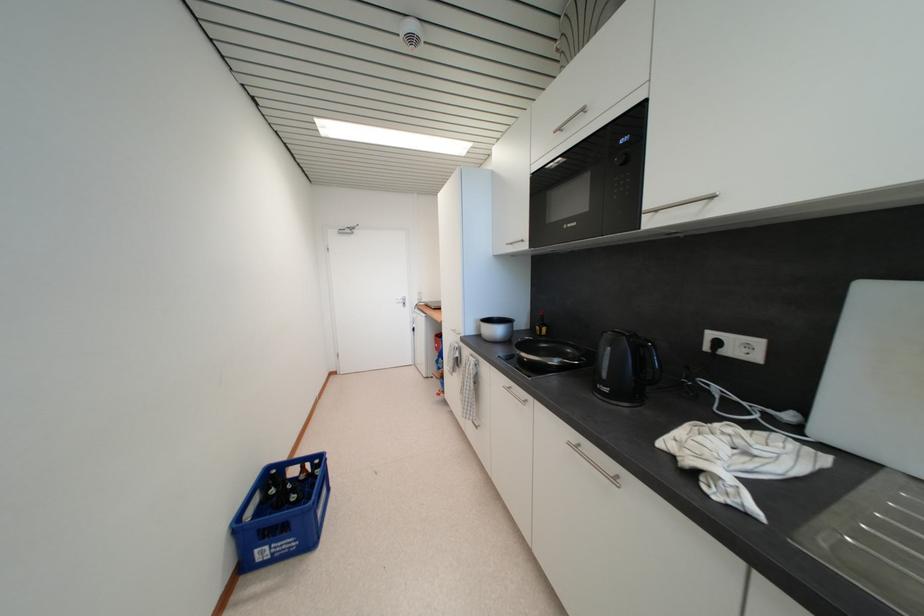
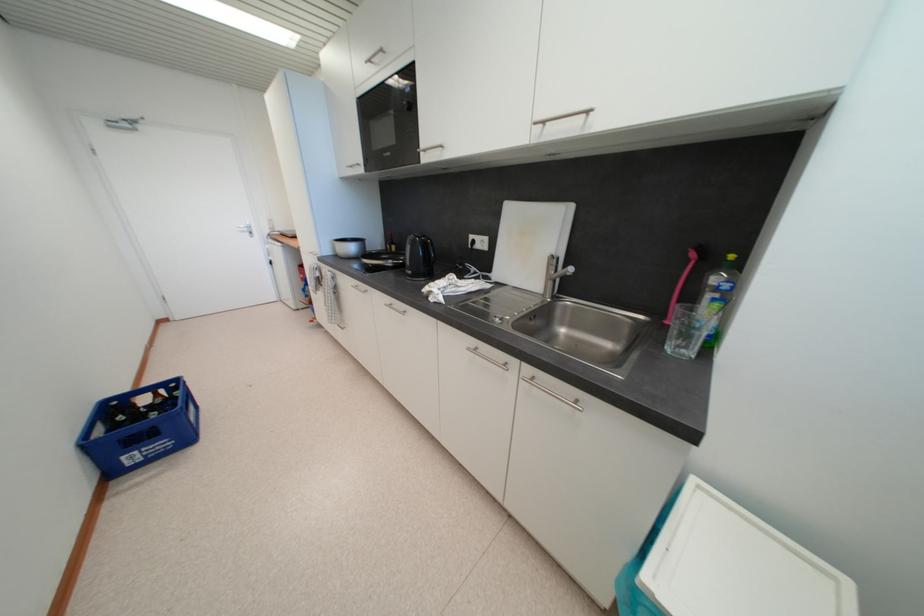
Locate, in the second image, the point that corresponds to point (652, 208) in the first image.

(428, 148)